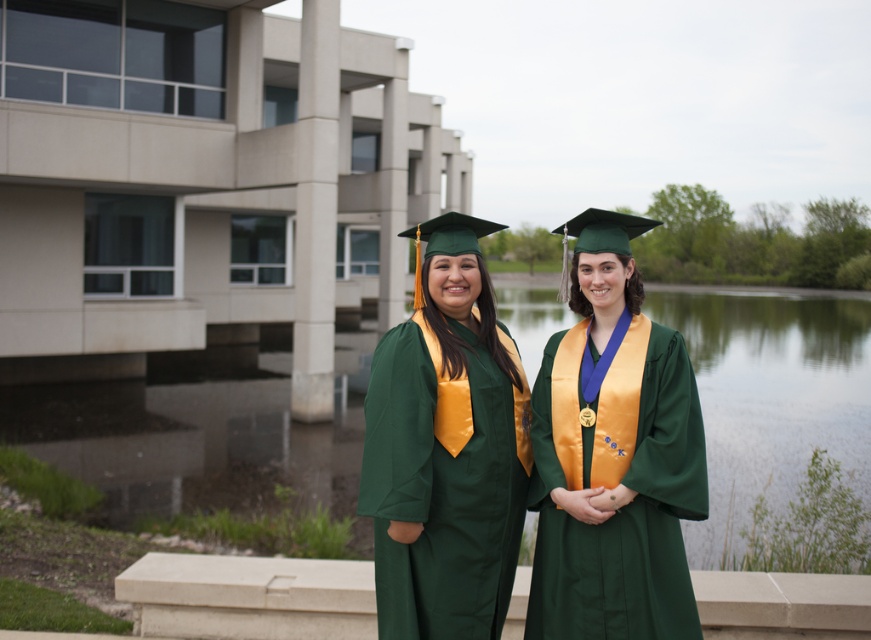
Does green satin graduation gown at center appear over green matte graduation gown at center?

No.

Between green satin graduation gown at center and green matte graduation gown at center, which one appears on the left side from the viewer's perspective?

green matte graduation gown at center is more to the left.

Is point (665, 600) positioned behind point (382, 445)?

No, it is not.

Where is `green satin graduation gown at center`? green satin graduation gown at center is located at coordinates (613, 456).